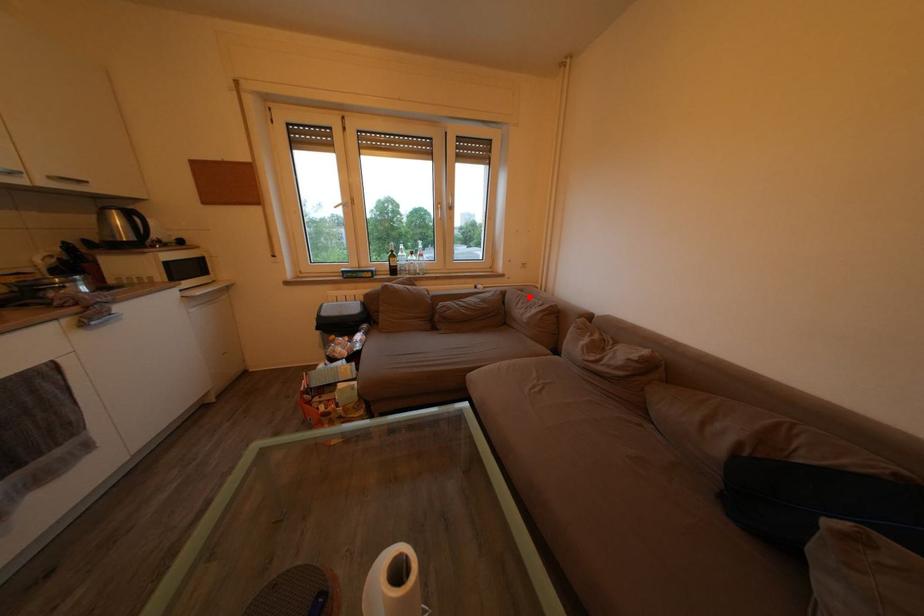
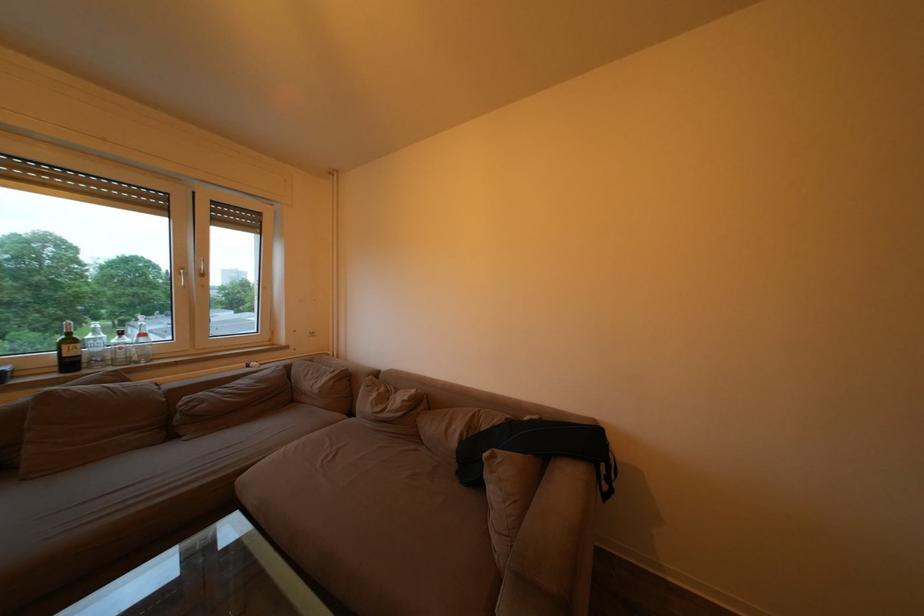
Find the pixel in the second image that matches the highlighted location in the first image.

(319, 367)